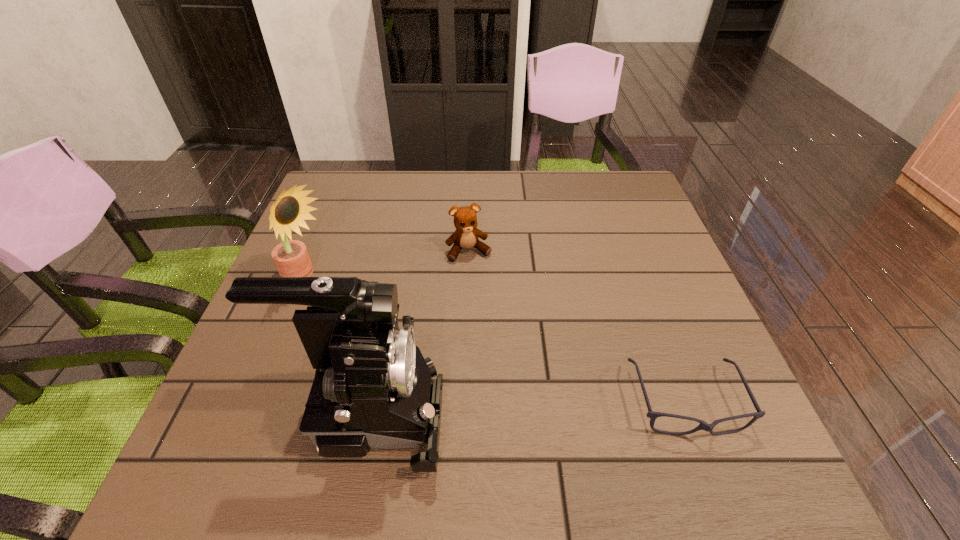
The image size is (960, 540). In order to click on vacant space on the desktop that is between the tallest object and the shortest object and is positioned on the face of the leftmost object in this screenshot , I will do `click(569, 407)`.

The width and height of the screenshot is (960, 540). Find the location of `vacant space on the desktop that is between the camcorder and the spectacles and is positioned on the front-facing side of the third tallest object`. vacant space on the desktop that is between the camcorder and the spectacles and is positioned on the front-facing side of the third tallest object is located at coordinates (525, 408).